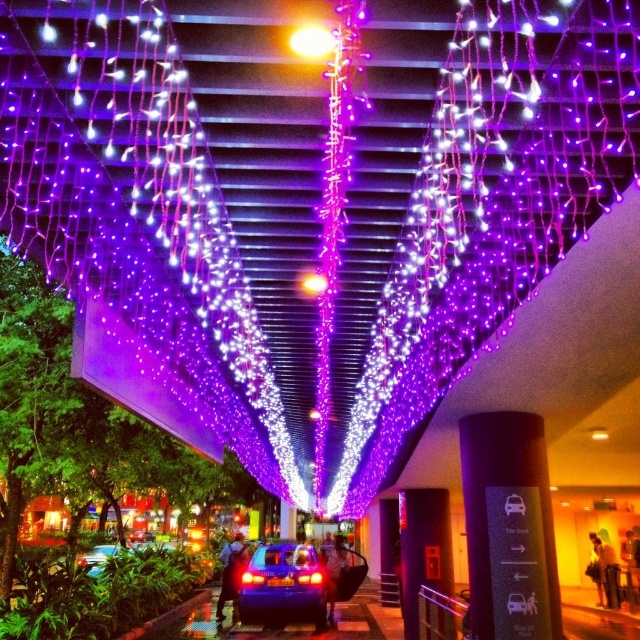
Does shiny blue car at center appear over metallic blue car at center?

Indeed, shiny blue car at center is positioned over metallic blue car at center.

Between shiny blue car at center and metallic blue car at center, which one appears on the left side from the viewer's perspective?

Answer: metallic blue car at center

The height and width of the screenshot is (640, 640). Describe the element at coordinates (282, 586) in the screenshot. I see `shiny blue car at center` at that location.

In order to click on shiny blue car at center in this screenshot , I will do `click(282, 586)`.